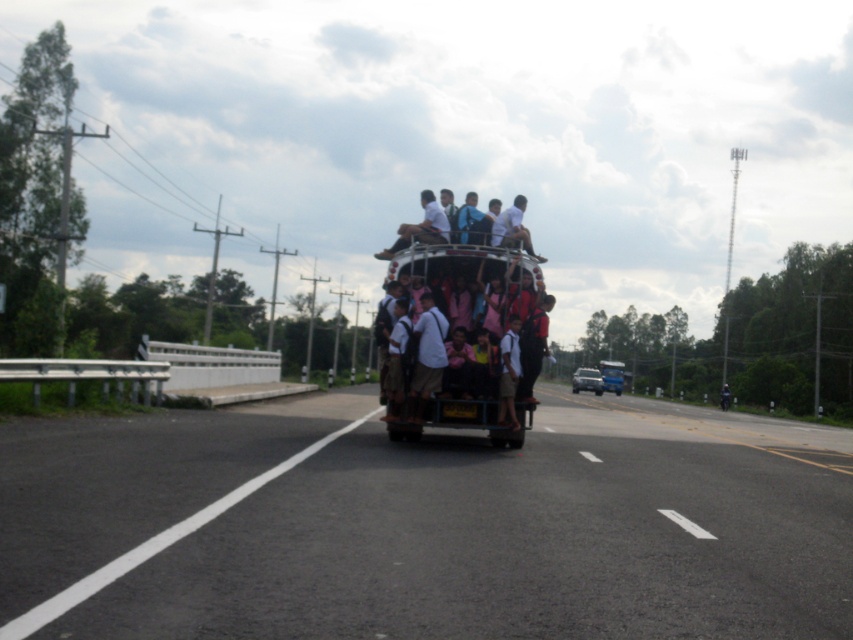
You are a pedestrian standing at the start of the black asphalt road at center. You want to cross the road to reach the other side. Is the metallic silver truck at center blocking your path?

The black asphalt road at center is located above the metallic silver truck at center, so the truck is not blocking your path because it is positioned below the road.

You are standing at point [612,372] and want to walk to point [836,627]. Which direction should you face to walk towards your destination?

You should face forward because point [836,627] is in front of point [612,372].